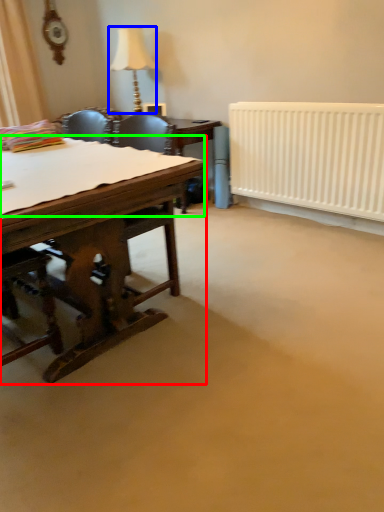
Question: Based on their relative distances, which object is farther from desk (highlighted by a red box)? Choose from lamp (highlighted by a blue box) and sheet (highlighted by a green box).

Choices:
 (A) lamp
 (B) sheet

Answer: (A)